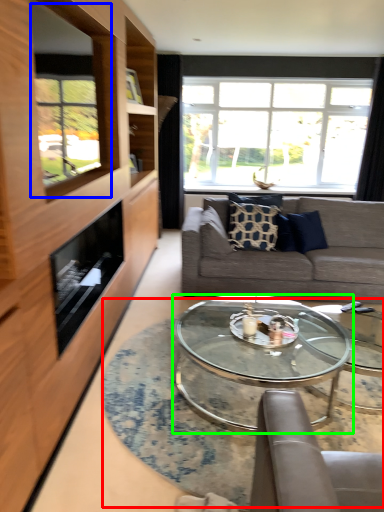
Question: Considering the real-world distances, which object is farthest from table (highlighted by a red box)? window screen (highlighted by a blue box) or coffee table (highlighted by a green box)?

Choices:
 (A) window screen
 (B) coffee table

Answer: (A)